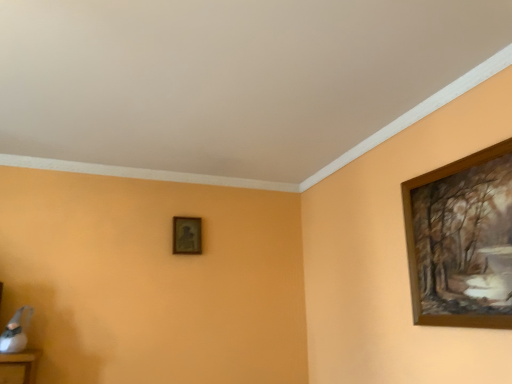
Question: Considering the relative positions of wooden picture frame at upper right, which is the second picture frame from left to right, and matte gold picture frame at center, which appears as the second picture frame when viewed from the right, in the image provided, is wooden picture frame at upper right, which is the second picture frame from left to right, to the left of matte gold picture frame at center, which appears as the second picture frame when viewed from the right, from the viewer's perspective?

Choices:
 (A) no
 (B) yes

Answer: (A)

Question: Can you confirm if wooden picture frame at upper right, the 1th picture frame from the right, is shorter than matte gold picture frame at center, the 2th picture frame viewed from the front?

Choices:
 (A) no
 (B) yes

Answer: (A)

Question: Is wooden picture frame at upper right, the 1th picture frame from the right, aimed at matte gold picture frame at center, the 2th picture frame viewed from the front?

Choices:
 (A) yes
 (B) no

Answer: (B)

Question: Is wooden picture frame at upper right, which ranks as the second picture frame in back-to-front order, turned away from matte gold picture frame at center, which appears as the second picture frame when viewed from the right?

Choices:
 (A) no
 (B) yes

Answer: (A)

Question: Is matte gold picture frame at center, arranged as the 1th picture frame when viewed from the left, completely or partially inside wooden picture frame at upper right, acting as the first picture frame starting from the front?

Choices:
 (A) yes
 (B) no

Answer: (B)

Question: From a real-world perspective, does wooden picture frame at upper right, the 1th picture frame from the right, sit lower than matte gold picture frame at center, which appears as the second picture frame when viewed from the right?

Choices:
 (A) no
 (B) yes

Answer: (B)

Question: Considering the relative positions of matte gold picture frame at center, which is counted as the first picture frame, starting from the back, and wooden picture frame at upper right, acting as the first picture frame starting from the front, in the image provided, is matte gold picture frame at center, which is counted as the first picture frame, starting from the back, to the right of wooden picture frame at upper right, acting as the first picture frame starting from the front, from the viewer's perspective?

Choices:
 (A) no
 (B) yes

Answer: (A)

Question: From the image's perspective, is matte gold picture frame at center, which is counted as the first picture frame, starting from the back, below wooden picture frame at upper right, which is the second picture frame from left to right?

Choices:
 (A) yes
 (B) no

Answer: (A)

Question: From a real-world perspective, does matte gold picture frame at center, which is counted as the first picture frame, starting from the back, sit lower than wooden picture frame at upper right, the 1th picture frame from the right?

Choices:
 (A) no
 (B) yes

Answer: (A)

Question: Is matte gold picture frame at center, which is counted as the first picture frame, starting from the back, with wooden picture frame at upper right, the 1th picture frame from the right?

Choices:
 (A) yes
 (B) no

Answer: (B)

Question: Is matte gold picture frame at center, which appears as the second picture frame when viewed from the right, shorter than wooden picture frame at upper right, which ranks as the second picture frame in back-to-front order?

Choices:
 (A) yes
 (B) no

Answer: (A)

Question: Is matte gold picture frame at center, which is counted as the first picture frame, starting from the back, behind wooden picture frame at upper right, acting as the first picture frame starting from the front?

Choices:
 (A) yes
 (B) no

Answer: (A)

Question: Visually, is wooden picture frame at upper right, acting as the first picture frame starting from the front, positioned to the left or to the right of matte gold picture frame at center, arranged as the 1th picture frame when viewed from the left?

Choices:
 (A) right
 (B) left

Answer: (A)